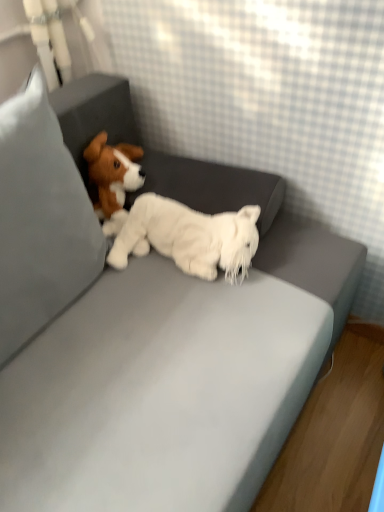
The width and height of the screenshot is (384, 512). Identify the location of white fabric pillow at left. (40, 219).

What is the approximate height of white fabric pillow at left?

white fabric pillow at left is 17.79 inches tall.

This screenshot has height=512, width=384. What do you see at coordinates (40, 219) in the screenshot? I see `white fabric pillow at left` at bounding box center [40, 219].

Locate an element on the screen. white plush toy at center is located at coordinates (188, 237).

Describe the element at coordinates (188, 237) in the screenshot. I see `white plush toy at center` at that location.

Locate an element on the screen. The image size is (384, 512). white fabric pillow at left is located at coordinates (40, 219).

Does white plush toy at center appear on the left side of white fabric pillow at left?

Incorrect, white plush toy at center is not on the left side of white fabric pillow at left.

Does white plush toy at center lie behind white fabric pillow at left?

Yes, the depth of white plush toy at center is greater than that of white fabric pillow at left.

Which point is more forward, (219, 220) or (50, 177)?

The point (50, 177) is closer to the camera.

From the image's perspective, relative to white fabric pillow at left, is white plush toy at center above or below?

white plush toy at center is situated lower than white fabric pillow at left in the image.

From a real-world perspective, is white plush toy at center physically below white fabric pillow at left?

Yes.

Which of these two, white plush toy at center or white fabric pillow at left, is wider?

white fabric pillow at left is wider.

Considering the sizes of objects white plush toy at center and white fabric pillow at left in the image provided, who is shorter, white plush toy at center or white fabric pillow at left?

With less height is white plush toy at center.

Considering the sizes of objects white plush toy at center and white fabric pillow at left in the image provided, who is bigger, white plush toy at center or white fabric pillow at left?

white fabric pillow at left.

Would you say white plush toy at center is inside or outside white fabric pillow at left?

white plush toy at center is outside white fabric pillow at left.

Are white plush toy at center and white fabric pillow at left far apart?

That's not correct — white plush toy at center is a little close to white fabric pillow at left.

Is white fabric pillow at left at the back of white plush toy at center?

No, white fabric pillow at left is not at the back of white plush toy at center.

The height and width of the screenshot is (512, 384). Identify the location of dog below the white fabric pillow at left (from a real-world perspective). point(188,237).

Is white fabric pillow at left at the left side of white plush toy at center?

Correct, you'll find white fabric pillow at left to the left of white plush toy at center.

Which object is further away from the camera, white fabric pillow at left or white plush toy at center?

white plush toy at center is further away from the camera.

Is point (20, 283) closer to camera compared to point (220, 225)?

Yes, point (20, 283) is closer to viewer.

From the image's perspective, is white fabric pillow at left located beneath white plush toy at center?

No, from the image's perspective, white fabric pillow at left is not below white plush toy at center.

From a real-world perspective, is white fabric pillow at left under white plush toy at center?

No, from a real-world perspective, white fabric pillow at left is not under white plush toy at center.

Which object is wider, white fabric pillow at left or white plush toy at center?

Wider between the two is white fabric pillow at left.

Does white fabric pillow at left have a lesser height compared to white plush toy at center?

In fact, white fabric pillow at left may be taller than white plush toy at center.

Considering the relative sizes of white fabric pillow at left and white plush toy at center in the image provided, is white fabric pillow at left smaller than white plush toy at center?

No, white fabric pillow at left is not smaller than white plush toy at center.

Is white plush toy at center a part of white fabric pillow at left?

No, white plush toy at center is not inside white fabric pillow at left.

Is white fabric pillow at left far away from white plush toy at center?

No, there isn't a large distance between white fabric pillow at left and white plush toy at center.

Could you tell me if white fabric pillow at left is facing white plush toy at center?

Yes, white fabric pillow at left is turned towards white plush toy at center.

Can you tell me how much white fabric pillow at left and white plush toy at center differ in facing direction?

There is a 71.6-degree angle between the facing directions of white fabric pillow at left and white plush toy at center.

How distant is white fabric pillow at left from white plush toy at center?

white fabric pillow at left is 9.18 inches from white plush toy at center.

The height and width of the screenshot is (512, 384). What are the coordinates of `dog below the white fabric pillow at left (from the image's perspective)` in the screenshot? It's located at (188, 237).

This screenshot has width=384, height=512. I want to click on pillow that appears above the white plush toy at center (from the image's perspective), so click(40, 219).

Image resolution: width=384 pixels, height=512 pixels. In order to click on dog that appears on the right of white fabric pillow at left in this screenshot , I will do `click(188, 237)`.